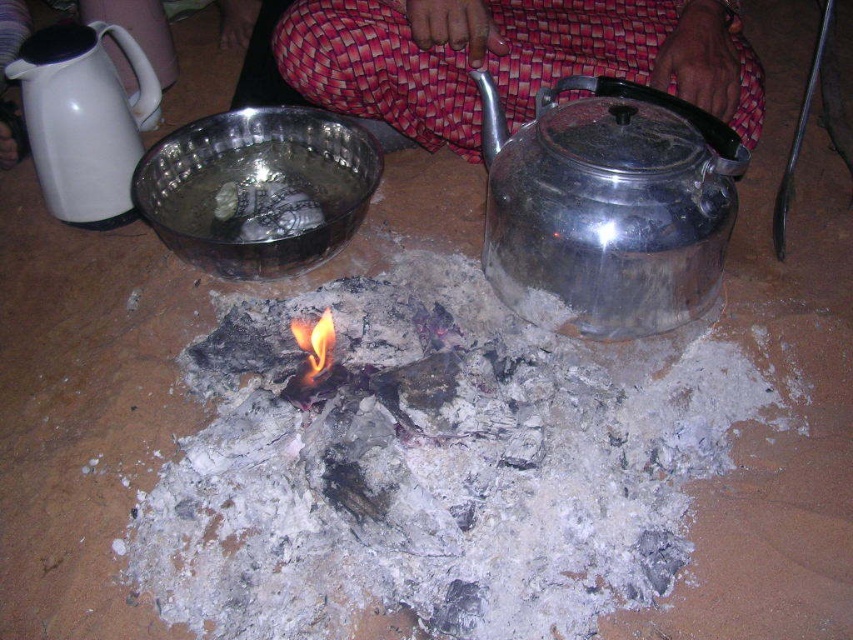
Question: Estimate the real-world distances between objects in this image. Which object is closer to the shiny metallic teapot at right?

Choices:
 (A) flametransparentfire at center
 (B) white glossy electric kettle at upper left
 (C) charcoal ash at center

Answer: (C)

Question: Is white glossy electric kettle at upper left thinner than flametransparentfire at center?

Choices:
 (A) yes
 (B) no

Answer: (B)

Question: Is shiny metallic food at center smaller than flametransparentfire at center?

Choices:
 (A) no
 (B) yes

Answer: (A)

Question: Can you confirm if charcoal ash at center is positioned to the left of white glossy electric kettle at upper left?

Choices:
 (A) yes
 (B) no

Answer: (B)

Question: Which of the following is the closest to the observer?

Choices:
 (A) shiny metallic teapot at right
 (B) charcoal ash at center

Answer: (B)

Question: Which point is closer to the camera?

Choices:
 (A) red woven pants at center
 (B) shiny metallic food at center

Answer: (A)